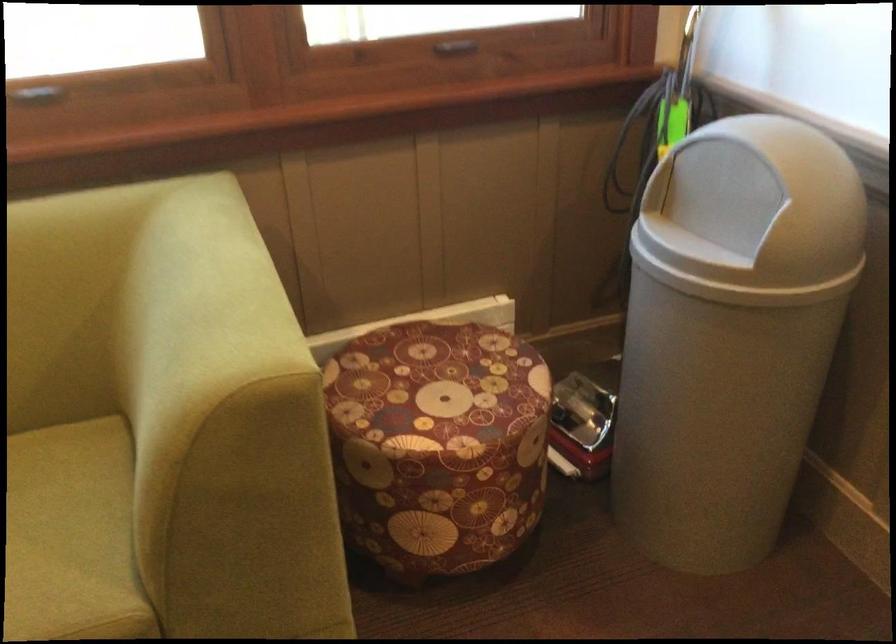
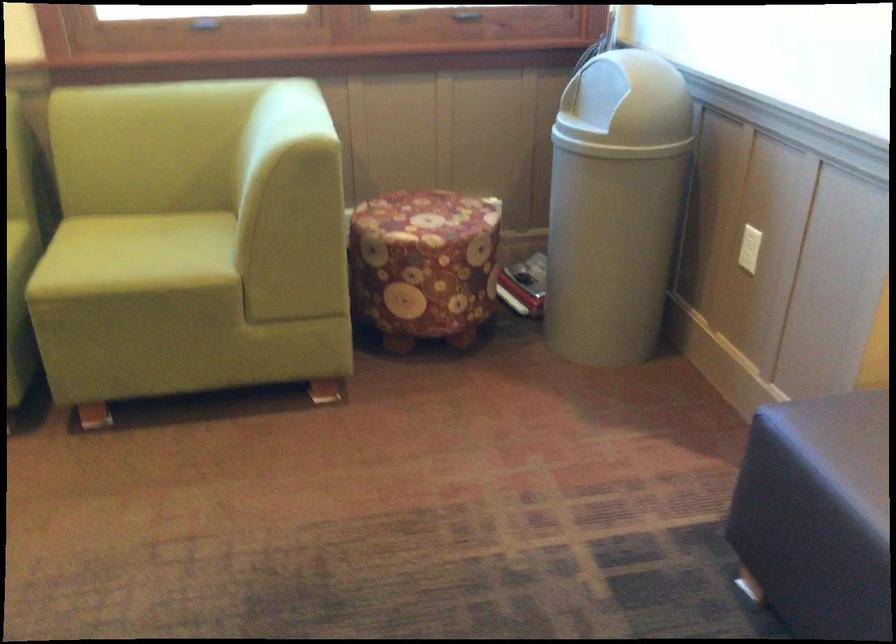
Find the pixel in the second image that matches pixel 418 366 in the first image.

(414, 207)